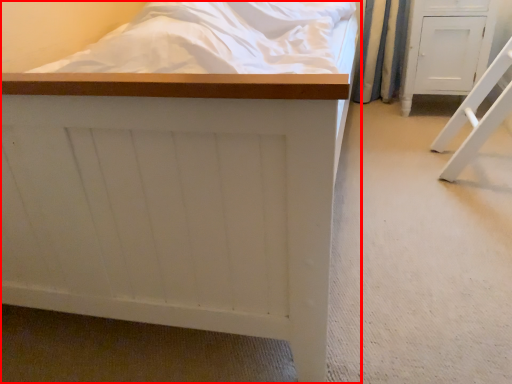
Question: From the image's perspective, where is furniture (annotated by the red box) located relative to furniture?

Choices:
 (A) below
 (B) above

Answer: (A)